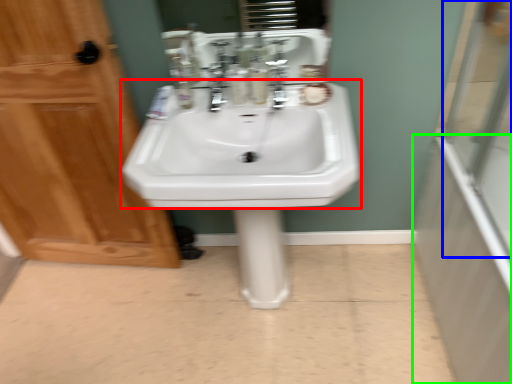
Question: Which object is positioned closest to sink (highlighted by a red box)? Select from glass door (highlighted by a blue box) and bath (highlighted by a green box).

Choices:
 (A) glass door
 (B) bath

Answer: (B)